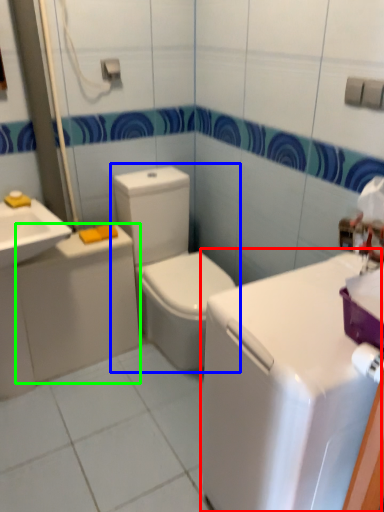
Question: Considering the real-world distances, which object is closest to counter top (highlighted by a red box)? toilet (highlighted by a blue box) or appliance (highlighted by a green box).

Choices:
 (A) toilet
 (B) appliance

Answer: (A)